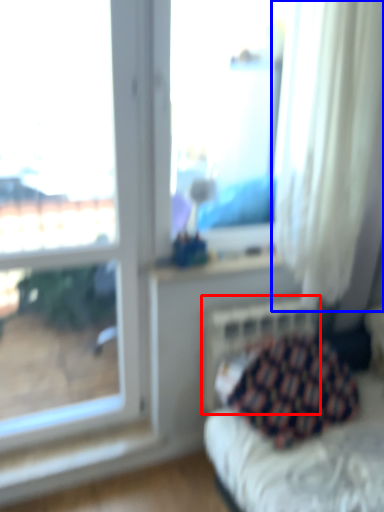
Question: Among these objects, which one is nearest to the camera, radiator (highlighted by a red box) or curtain (highlighted by a blue box)?

Choices:
 (A) radiator
 (B) curtain

Answer: (B)